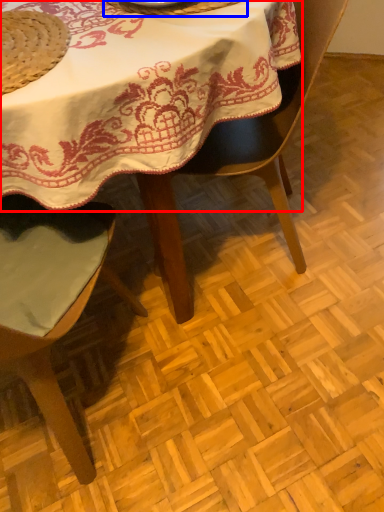
Question: Which object is closer to the camera taking this photo, table (highlighted by a red box) or tableware (highlighted by a blue box)?

Choices:
 (A) table
 (B) tableware

Answer: (A)